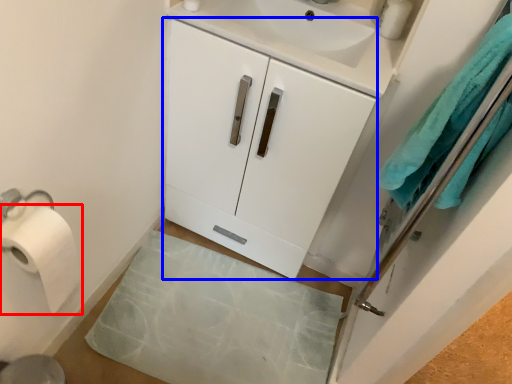
Question: Which object appears closest to the camera in this image, toilet paper (highlighted by a red box) or cabinetry (highlighted by a blue box)?

Choices:
 (A) toilet paper
 (B) cabinetry

Answer: (A)